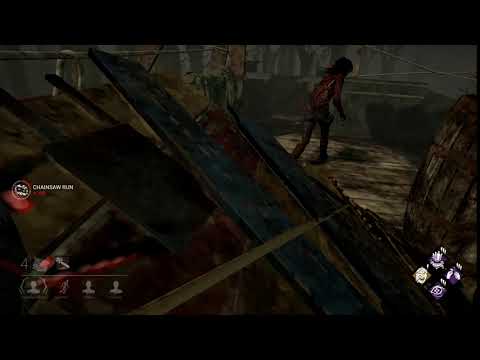
Locate the grayish wall in the background.  almost looks like clothes hanging on the wall in the image. Your answer should be formatted as a list of tuples, i.e. [(x1, y1), (x2, y2), ...], where each tuple contains the x and y coordinates of a point satisfying the conditions above.

[(416, 56), (290, 62), (455, 68), (270, 62), (364, 52)]